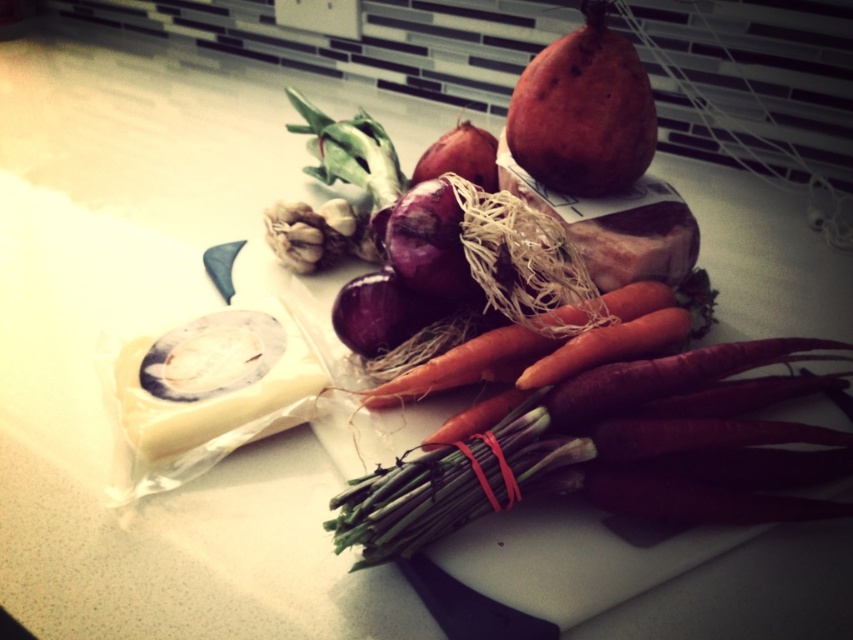
Question: Which object is closer to the camera taking this photo?

Choices:
 (A) matte purple onion at center
 (B) smooth orange carrot at center

Answer: (B)

Question: Which of the following is the closest to the observer?

Choices:
 (A) (357, 353)
 (B) (514, 330)
 (C) (399, 211)

Answer: (B)

Question: Does smooth orange carrot at center have a smaller size compared to white matte garlic at center?

Choices:
 (A) no
 (B) yes

Answer: (A)

Question: In this image, where is smooth orange carrot at center located relative to matte purple onion at center?

Choices:
 (A) left
 (B) right

Answer: (B)

Question: Which point appears farthest from the camera in this image?

Choices:
 (A) (529, 337)
 (B) (355, 321)
 (C) (339, 257)
 (D) (418, 262)

Answer: (C)

Question: In this image, where is smooth brown potato at upper center located relative to purple matte onion at center?

Choices:
 (A) below
 (B) above

Answer: (B)